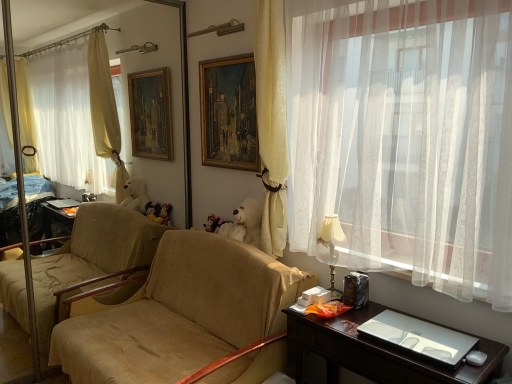
Question: Does velvet plush toy at center have a lesser width compared to wooden oil painting at center?

Choices:
 (A) no
 (B) yes

Answer: (A)

Question: Considering the relative positions of velvet plush toy at center and wooden oil painting at center in the image provided, is velvet plush toy at center to the left of wooden oil painting at center from the viewer's perspective?

Choices:
 (A) no
 (B) yes

Answer: (B)

Question: Does velvet plush toy at center turn towards wooden oil painting at center?

Choices:
 (A) no
 (B) yes

Answer: (A)

Question: From a real-world perspective, is velvet plush toy at center located higher than wooden oil painting at center?

Choices:
 (A) no
 (B) yes

Answer: (A)

Question: Can you confirm if velvet plush toy at center is shorter than wooden oil painting at center?

Choices:
 (A) yes
 (B) no

Answer: (A)

Question: Can you see velvet plush toy at center touching wooden oil painting at center?

Choices:
 (A) no
 (B) yes

Answer: (A)

Question: Is beige fabric couch at center to the left of yellow fabric curtain at center, the 2th curtain from the right, from the viewer's perspective?

Choices:
 (A) yes
 (B) no

Answer: (A)

Question: Can yellow fabric curtain at center, positioned as the first curtain in left-to-right order, be found inside beige fabric couch at center?

Choices:
 (A) yes
 (B) no

Answer: (B)

Question: From the image's perspective, is beige fabric couch at center over yellow fabric curtain at center, positioned as the first curtain in left-to-right order?

Choices:
 (A) yes
 (B) no

Answer: (B)

Question: Does beige fabric couch at center lie behind yellow fabric curtain at center, positioned as the first curtain in left-to-right order?

Choices:
 (A) no
 (B) yes

Answer: (A)

Question: Is beige fabric couch at center smaller than yellow fabric curtain at center, the 2th curtain from the right?

Choices:
 (A) no
 (B) yes

Answer: (A)

Question: Is beige fabric couch at center at the right side of yellow fabric curtain at center, positioned as the first curtain in left-to-right order?

Choices:
 (A) yes
 (B) no

Answer: (B)

Question: Is beige fabric couch at center positioned far away from shiny dark wood desk at lower right?

Choices:
 (A) yes
 (B) no

Answer: (B)